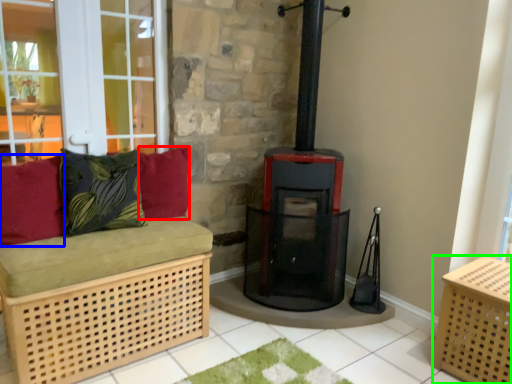
Question: Based on their relative distances, which object is nearer to pillow (highlighted by a red box)? Choose from pillow (highlighted by a blue box) and crate (highlighted by a green box).

Choices:
 (A) pillow
 (B) crate

Answer: (A)